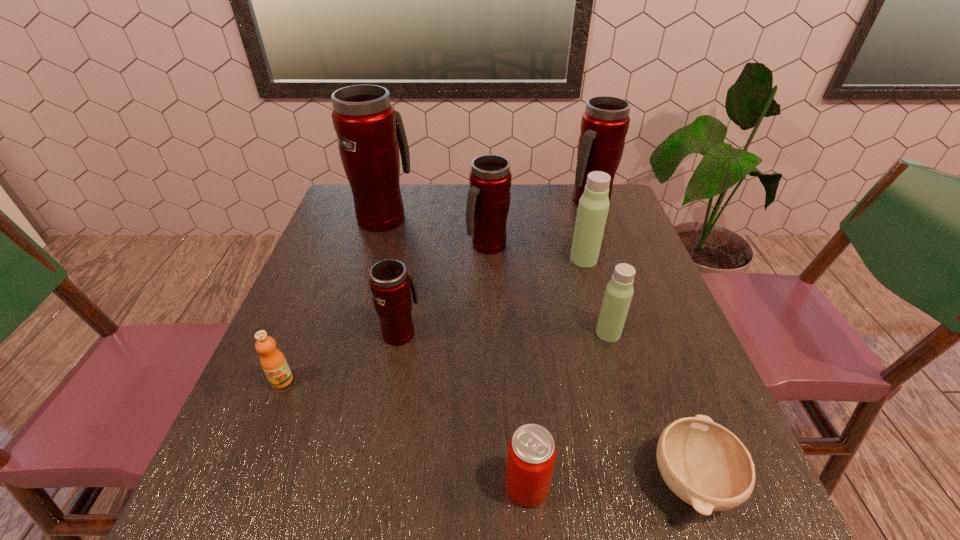
At what (x,y) coordinates should I click in order to perform the action: click on bowl at the right edge. Please return your answer as a coordinate pair (x, y). This screenshot has height=540, width=960. Looking at the image, I should click on (703, 463).

I want to click on object that is at the far left corner, so click(370, 133).

Identify the location of object positioned at the far right corner. This screenshot has width=960, height=540. (604, 125).

Find the location of a particular element. The height and width of the screenshot is (540, 960). object located at the near right corner is located at coordinates (703, 463).

I want to click on blank space at the far edge of the desktop, so click(430, 214).

This screenshot has height=540, width=960. In the image, there is a desktop. What are the coordinates of `free region at the near edge` in the screenshot? It's located at (509, 509).

Find the location of `vacant space at the left edge of the desktop`. vacant space at the left edge of the desktop is located at coordinates (302, 344).

Identify the location of vacant space at the right edge of the desktop. (613, 270).

Where is `vacant space at the near left corner of the desktop`? vacant space at the near left corner of the desktop is located at coordinates (191, 528).

What are the coordinates of `vacant point at the near right corner` in the screenshot? It's located at (678, 508).